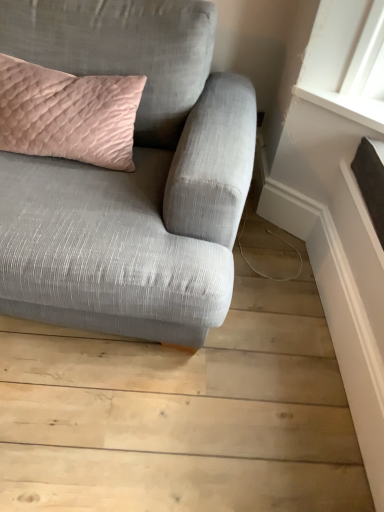
Question: Does point (196, 343) appear closer or farther from the camera than point (11, 71)?

Choices:
 (A) farther
 (B) closer

Answer: (B)

Question: Is textured gray couch at upper left situated inside pink quilted cushion at upper left or outside?

Choices:
 (A) inside
 (B) outside

Answer: (B)

Question: Looking at their shapes, would you say textured gray couch at upper left is wider or thinner than pink quilted cushion at upper left?

Choices:
 (A) thin
 (B) wide

Answer: (B)

Question: In terms of size, does pink quilted cushion at upper left appear bigger or smaller than textured gray couch at upper left?

Choices:
 (A) small
 (B) big

Answer: (A)

Question: Relative to textured gray couch at upper left, is pink quilted cushion at upper left in front or behind?

Choices:
 (A) behind
 (B) front

Answer: (A)

Question: Is pink quilted cushion at upper left taller or shorter than textured gray couch at upper left?

Choices:
 (A) tall
 (B) short

Answer: (B)

Question: From the image's perspective, is pink quilted cushion at upper left positioned above or below textured gray couch at upper left?

Choices:
 (A) above
 (B) below

Answer: (A)